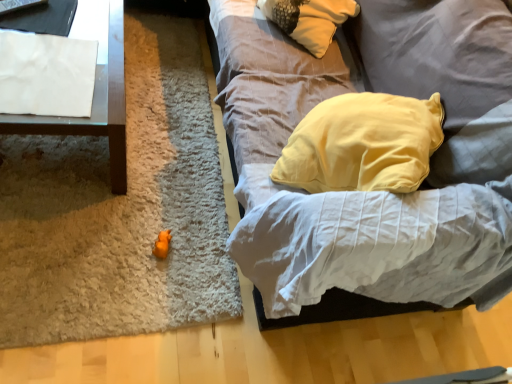
Locate an element on the screen. free point to the left of orange rubber duck at center is located at coordinates (122, 230).